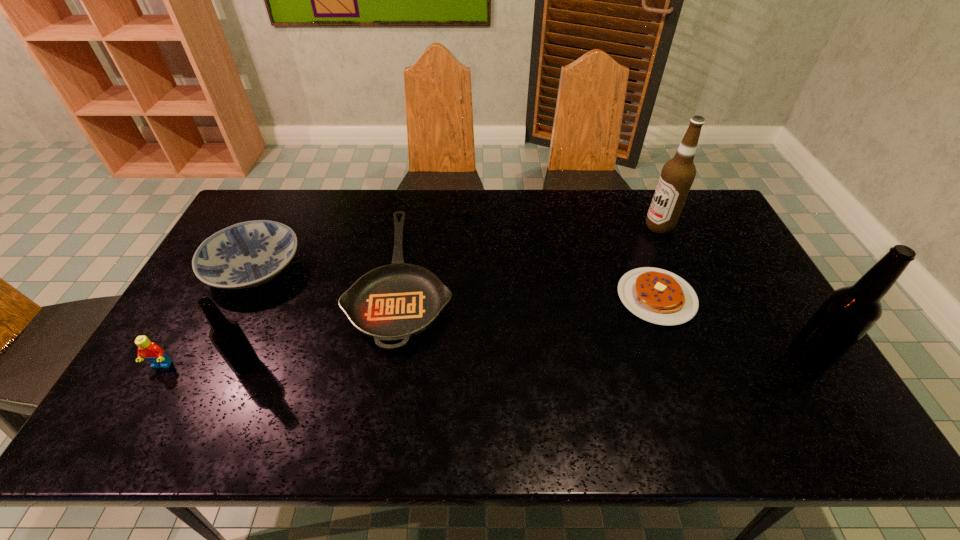
At what (x,y) coordinates should I click in order to perform the action: click on plate that is positioned at the left edge. Please return your answer as a coordinate pair (x, y). Looking at the image, I should click on (248, 254).

You are a GUI agent. You are given a task and a screenshot of the screen. Output one action in this format:
    pyautogui.click(x=<x>, y=<y>)
    Task: Click on the Lego at the left edge
    Image resolution: width=960 pixels, height=540 pixels.
    Given the screenshot: What is the action you would take?
    pyautogui.click(x=148, y=350)

Where is `object positioned at the right edge`? object positioned at the right edge is located at coordinates (849, 312).

The height and width of the screenshot is (540, 960). In order to click on object present at the near left corner in this screenshot , I will do `click(148, 350)`.

Locate an element on the screen. This screenshot has width=960, height=540. object that is at the near right corner is located at coordinates (849, 312).

I want to click on vacant space at the far edge, so click(618, 223).

Image resolution: width=960 pixels, height=540 pixels. What are the coordinates of `blank space at the near edge` in the screenshot? It's located at (222, 370).

The image size is (960, 540). In the image, there is a desktop. What are the coordinates of `vacant area at the left edge` in the screenshot? It's located at (208, 354).

Locate an element on the screen. The width and height of the screenshot is (960, 540). vacant space at the right edge of the desktop is located at coordinates (720, 276).

Find the location of a particular element. vacant point at the far left corner is located at coordinates (269, 193).